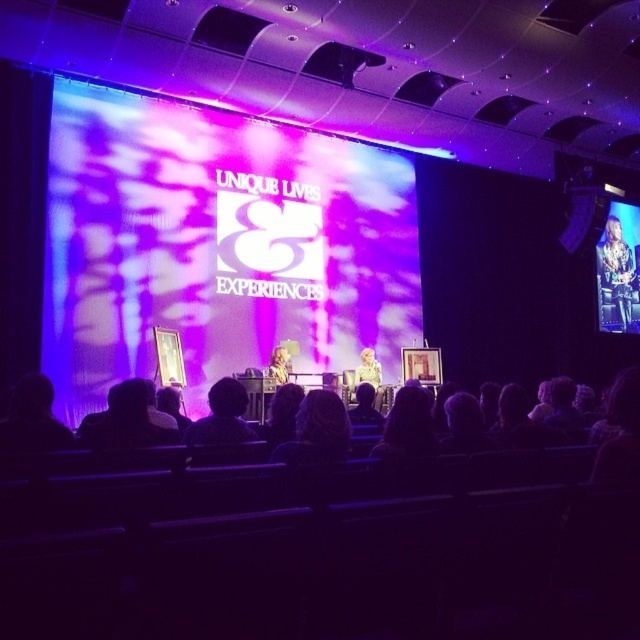
You are an attendee at this event and want to describe the seating arrangement to a friend who can see the stage. Which object is positioned to the right of the other between the light brown leather jacket at right and the blonde hair at center?

The light brown leather jacket at right is positioned to the right of the blonde hair at center.

You are an event organizer setting up the stage for a presentation. You need to place a 1.2 meter wide banner between the matte purple fabric at center and the light brown leather jacket at right. Can the space between them accommodate the banner?

The matte purple fabric at center has a smaller width than the light brown leather jacket at right. Since the banner is 1.2 meters wide, the space between them may not be sufficient if the distance between the two objects is less than 1.2 meters. However, the description only provides information about their widths, not the distance between them. Therefore, it is unclear if the banner will fit without additional measurements.

Looking at this image, you are an event organizer arranging items on the stage. You have the matte purple fabric at center and the light brown leather jacket at right. Which item takes up less space on the stage?

The matte purple fabric at center takes up less space on the stage because it has a smaller size compared to the light brown leather jacket at right.